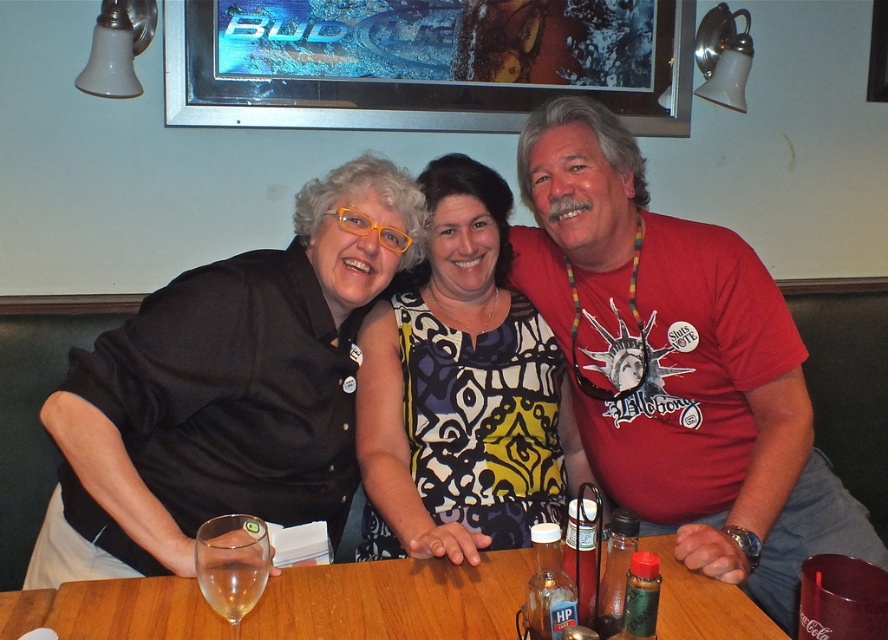
You are sitting at the wooden table with three people and want to place a small item between the two points on the table. Which point is closer to you, point (571, 480) or point (226, 637)?

Point (571, 480) is closer to you because it is further to the viewer than point (226, 637).

You are a waiter at a restaurant and need to place a new drink order for the red matte shirt at center and the clear glass wine glass at lower left. Which object requires a larger drink container?

The red matte shirt at center requires a larger drink container since it has a larger size compared to the clear glass wine glass at lower left.

What is the 2D coordinate of the red matte shirt at center?

The red matte shirt at center is located at the 2D coordinate point of [678,364].